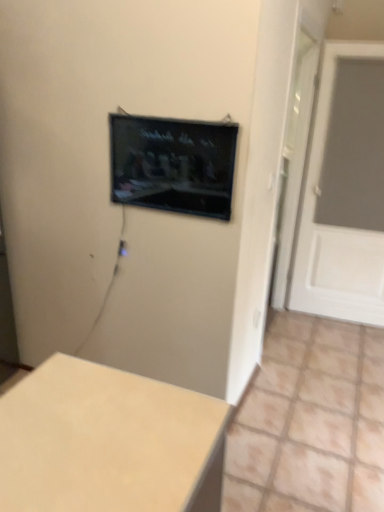
Question: From the image's perspective, relative to beige matte table at lower left, is black glossy tv at upper center above or below?

Choices:
 (A) above
 (B) below

Answer: (A)

Question: From a real-world perspective, is black glossy tv at upper center above or below beige matte table at lower left?

Choices:
 (A) above
 (B) below

Answer: (A)

Question: Which object is the farthest from the black glossy tv at upper center?

Choices:
 (A) white matte door at right
 (B) beige matte table at lower left

Answer: (A)

Question: Which is nearer to the black glossy tv at upper center?

Choices:
 (A) beige matte table at lower left
 (B) white matte door at right

Answer: (A)